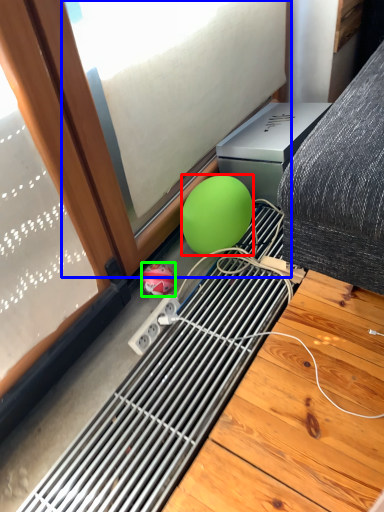
Question: Which is farther away from ball (highlighted by a red box)? window (highlighted by a blue box) or ball (highlighted by a green box)?

Choices:
 (A) window
 (B) ball

Answer: (A)